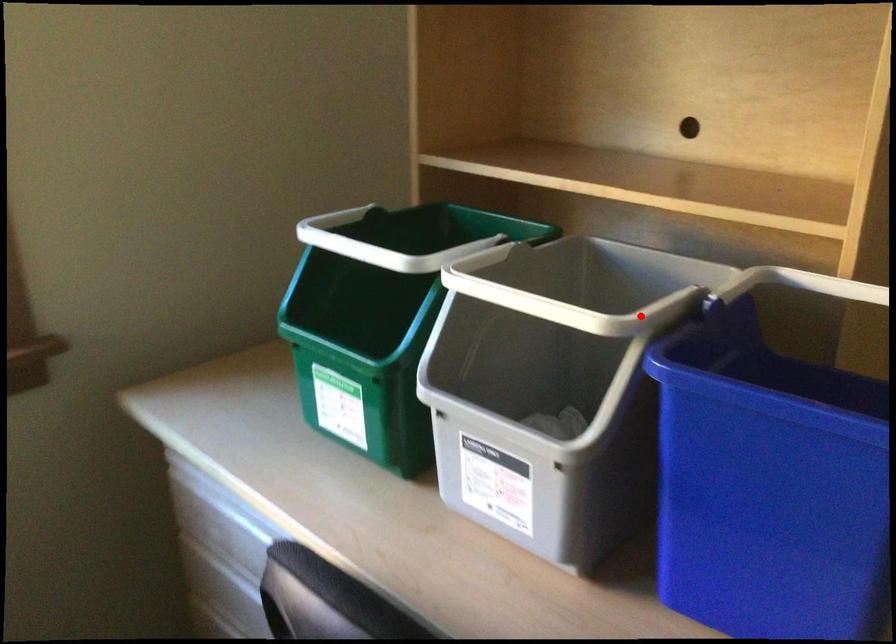
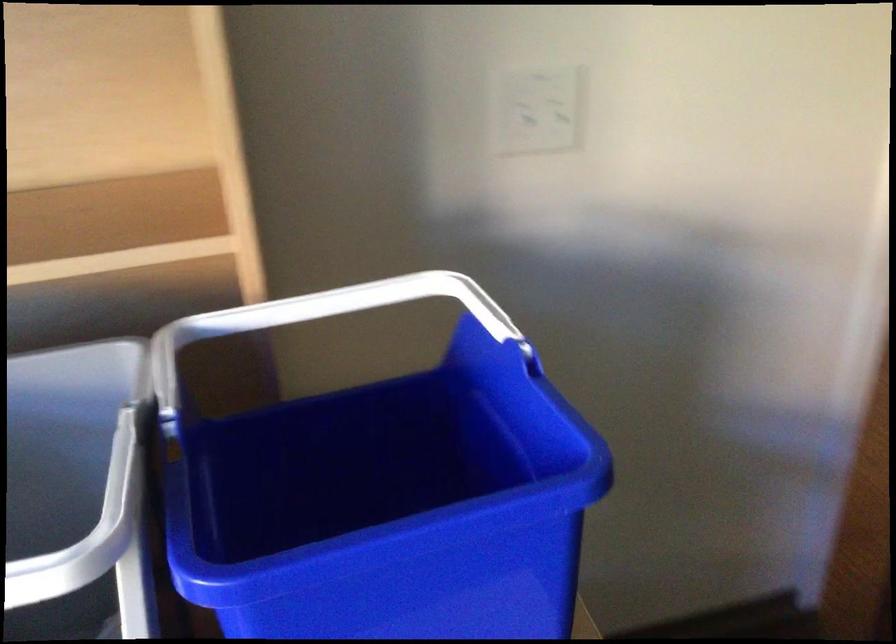
Question: A red point is marked in image1. In image2, is the corresponding 3D point closer to the camera or farther? Reply with the corresponding letter.

Choices:
 (A) The corresponding 3D point is closer.
 (B) The corresponding 3D point is farther.

Answer: (A)